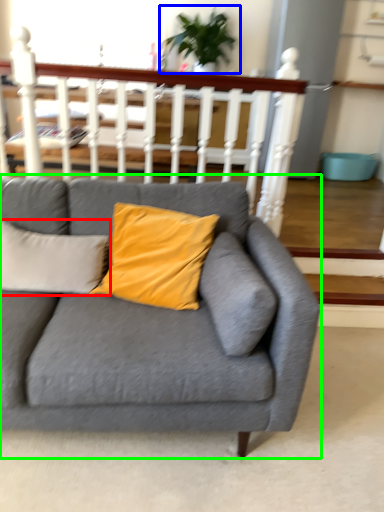
Question: Which is farther away from pillow (highlighted by a red box)? houseplant (highlighted by a blue box) or studio couch (highlighted by a green box)?

Choices:
 (A) houseplant
 (B) studio couch

Answer: (A)